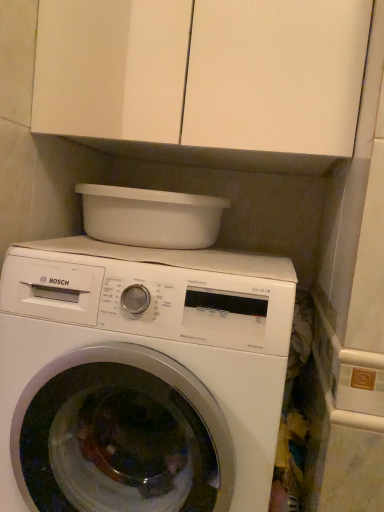
Question: Considering the relative positions of white glossy washing machine at center and white matte cabinet at upper center in the image provided, is white glossy washing machine at center to the right of white matte cabinet at upper center from the viewer's perspective?

Choices:
 (A) no
 (B) yes

Answer: (A)

Question: Is white glossy washing machine at center smaller than white matte cabinet at upper center?

Choices:
 (A) no
 (B) yes

Answer: (A)

Question: Is white glossy washing machine at center not within white matte cabinet at upper center?

Choices:
 (A) yes
 (B) no

Answer: (A)

Question: Can you confirm if white glossy washing machine at center is positioned to the left of white matte cabinet at upper center?

Choices:
 (A) yes
 (B) no

Answer: (A)

Question: From a real-world perspective, is white glossy washing machine at center located higher than white matte cabinet at upper center?

Choices:
 (A) yes
 (B) no

Answer: (B)

Question: From the image's perspective, is white glossy washing machine at center on top of white matte cabinet at upper center?

Choices:
 (A) no
 (B) yes

Answer: (A)

Question: Could you tell me if white matte cabinet at upper center is facing white plastic basin at upper center?

Choices:
 (A) no
 (B) yes

Answer: (A)

Question: Considering the relative sizes of white matte cabinet at upper center and white plastic basin at upper center in the image provided, is white matte cabinet at upper center thinner than white plastic basin at upper center?

Choices:
 (A) yes
 (B) no

Answer: (B)

Question: Can you confirm if white matte cabinet at upper center is taller than white plastic basin at upper center?

Choices:
 (A) no
 (B) yes

Answer: (B)

Question: Is white matte cabinet at upper center further to the viewer compared to white plastic basin at upper center?

Choices:
 (A) yes
 (B) no

Answer: (B)

Question: Considering the relative sizes of white matte cabinet at upper center and white plastic basin at upper center in the image provided, is white matte cabinet at upper center wider than white plastic basin at upper center?

Choices:
 (A) no
 (B) yes

Answer: (B)

Question: From a real-world perspective, is white matte cabinet at upper center positioned over white plastic basin at upper center based on gravity?

Choices:
 (A) no
 (B) yes

Answer: (B)

Question: Is white plastic basin at upper center surrounded by white glossy washing machine at center?

Choices:
 (A) no
 (B) yes

Answer: (A)